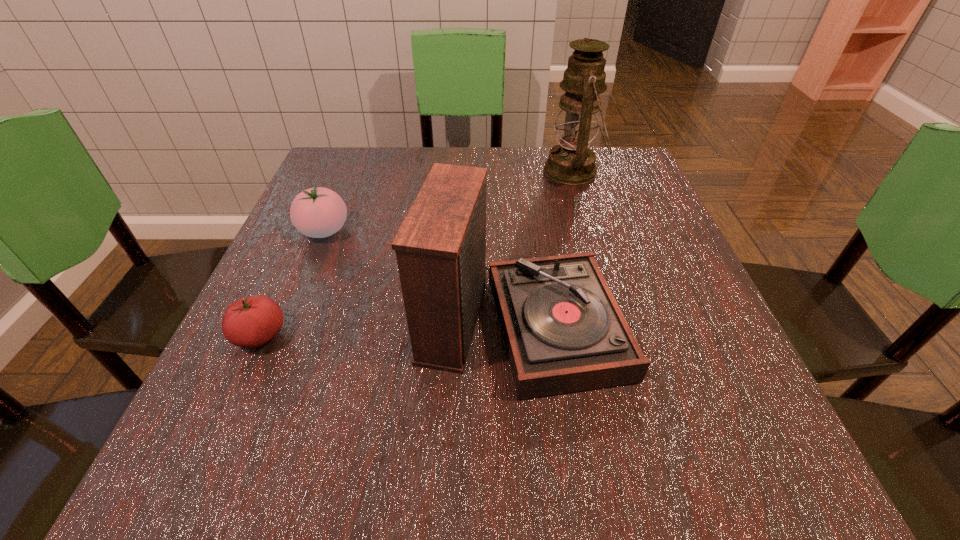
I want to click on vacant space in between the second shortest object and the shorter tomato, so click(293, 283).

Where is `vacant region between the second tallest object and the tallest object`? This screenshot has width=960, height=540. vacant region between the second tallest object and the tallest object is located at coordinates (546, 245).

You are a GUI agent. You are given a task and a screenshot of the screen. Output one action in this format:
    pyautogui.click(x=<x>, y=<y>)
    Task: Click on the free area in between the third shortest object and the nearer tomato
    
    Given the screenshot: What is the action you would take?
    pyautogui.click(x=391, y=328)

Locate which object is the closest to the shorter tomato. Please provide its 2D coordinates. Your answer should be formatted as a tuple, i.e. [(x, y)], where the tuple contains the x and y coordinates of a point satisfying the conditions above.

[(318, 212)]

Locate an element on the screen. the closest object to the phonograph record is located at coordinates (318, 212).

The width and height of the screenshot is (960, 540). What are the coordinates of `vacant region that satisfies the following two spatial constraints: 1. on the back side of the taller tomato; 2. on the left side of the tallest object` in the screenshot? It's located at (348, 171).

Find the location of `free region that satisfies the following two spatial constraints: 1. on the back side of the shortest object; 2. on the left side of the oil lamp`. free region that satisfies the following two spatial constraints: 1. on the back side of the shortest object; 2. on the left side of the oil lamp is located at coordinates (335, 171).

The width and height of the screenshot is (960, 540). What are the coordinates of `free space that satisfies the following two spatial constraints: 1. on the back side of the shorter tomato; 2. on the left side of the farthest object` in the screenshot? It's located at (335, 171).

Where is `vacant space that satisfies the following two spatial constraints: 1. on the back side of the farthest object; 2. on the right side of the shortest object`? vacant space that satisfies the following two spatial constraints: 1. on the back side of the farthest object; 2. on the right side of the shortest object is located at coordinates (335, 171).